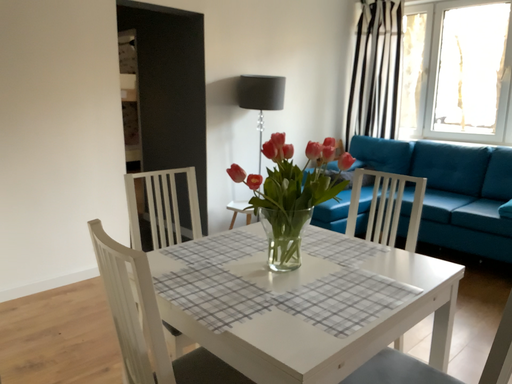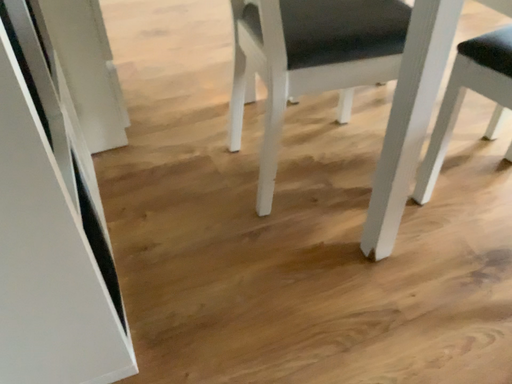
Question: Which way did the camera rotate in the video?

Choices:
 (A) rotated upward
 (B) rotated downward

Answer: (B)